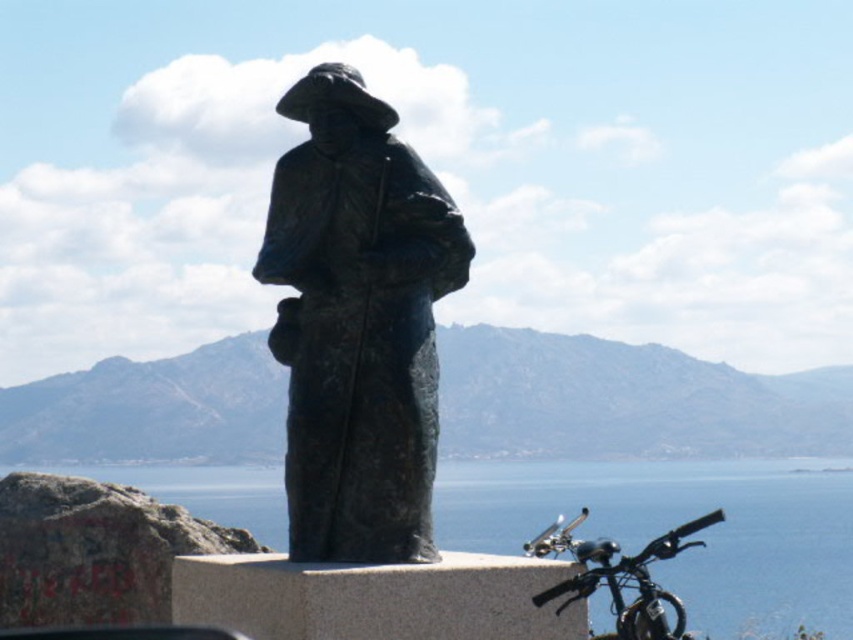
Between point (352, 88) and point (663, 512), which one is positioned in front?

Point (352, 88)

Does point (438, 282) come closer to viewer compared to point (566, 477)?

That is True.

Who is more distant from viewer, (302,228) or (837,589)?

The point (837,589) is more distant.

Locate an element on the screen. The image size is (853, 640). bronze statue at center is located at coordinates (357, 323).

Which is behind, point (299, 518) or point (547, 545)?

Point (547, 545)

Locate an element on the screen. This screenshot has height=640, width=853. bronze statue at center is located at coordinates (357, 323).

Between blue water at lower right and shiny black bicycle at lower right, which one appears on the left side from the viewer's perspective?

From the viewer's perspective, blue water at lower right appears more on the left side.

Is blue water at lower right smaller than shiny black bicycle at lower right?

No, blue water at lower right is not smaller than shiny black bicycle at lower right.

Which is in front, point (706, 529) or point (670, 545)?

Positioned in front is point (670, 545).

The image size is (853, 640). Find the location of `blue water at lower right`. blue water at lower right is located at coordinates (679, 524).